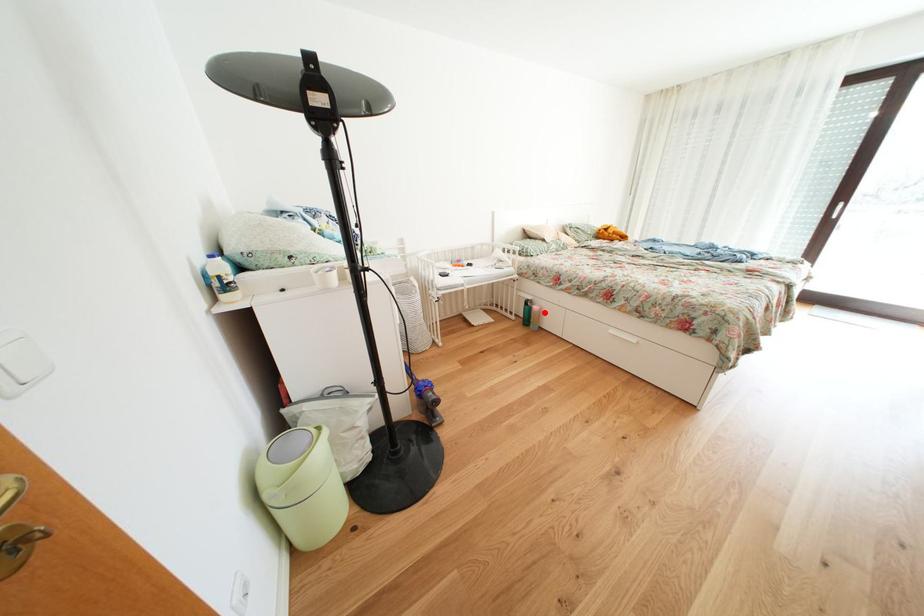
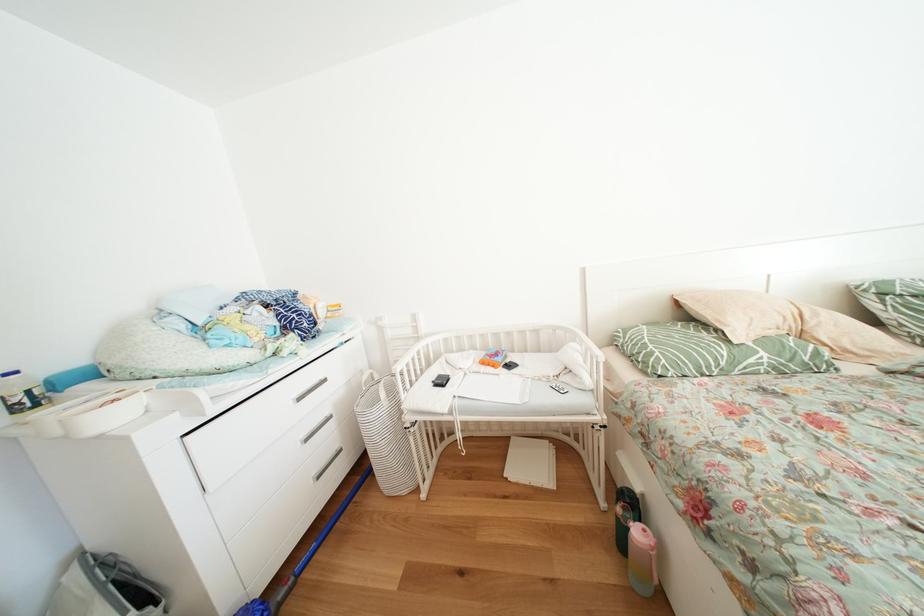
Question: I am providing you with two images of the same scene from different viewpoints. In image1, a red point is highlighted. Considering the same 3D point in image2, which of the following is correct?

Choices:
 (A) It is closer
 (B) It is farther

Answer: (B)